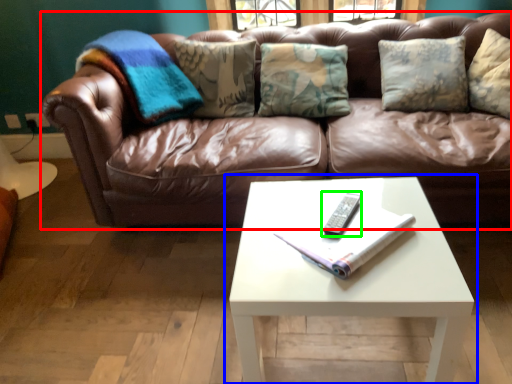
Question: Considering the real-world distances, which object is farthest from studio couch (highlighted by a red box)? coffee table (highlighted by a blue box) or remote (highlighted by a green box)?

Choices:
 (A) coffee table
 (B) remote

Answer: (B)